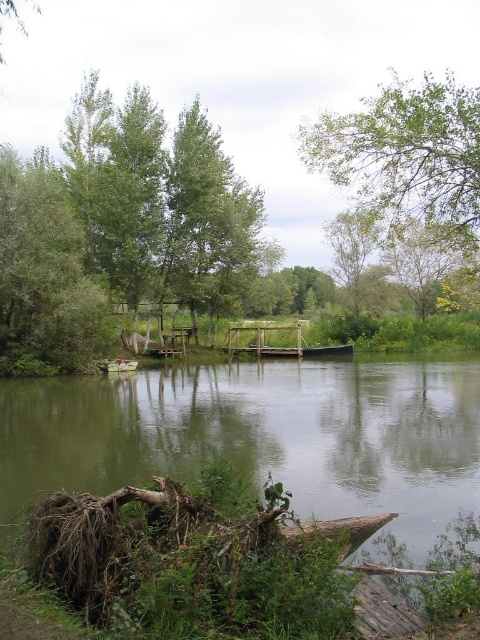
Who is more distant from viewer, (29, 304) or (268, 355)?

Point (268, 355)

Find the location of a particular element. This screenshot has height=640, width=480. green leafy tree at left is located at coordinates (45, 276).

Is green wood lake at center wider than green plastic boat at lower left?

Yes.

Can you confirm if green wood lake at center is positioned to the right of green plastic boat at lower left?

Yes, green wood lake at center is to the right of green plastic boat at lower left.

In order to click on green wood lake at center in this screenshot , I will do `click(263, 436)`.

Between green wood lake at center and green leafy tree at left, which one appears on the right side from the viewer's perspective?

Positioned to the right is green wood lake at center.

The width and height of the screenshot is (480, 640). Describe the element at coordinates (263, 436) in the screenshot. I see `green wood lake at center` at that location.

Find the location of `green wood lake at center`. green wood lake at center is located at coordinates (263, 436).